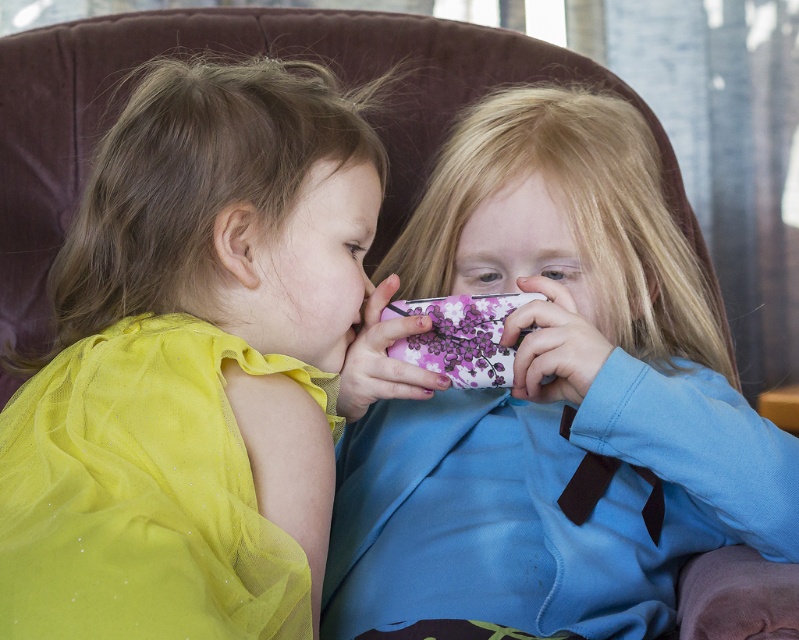
Between purple floral phone at center and matte yellow dress at left, which one has more height?

purple floral phone at center

Does point (654, 435) lie behind point (187, 243)?

No, it is in front of (187, 243).

Locate an element on the screen. This screenshot has width=799, height=640. purple floral phone at center is located at coordinates (549, 397).

Is point (330, 164) farther from camera compared to point (171, 541)?

Yes, it is.

The image size is (799, 640). What are the coordinates of `matte yellow dress at left` in the screenshot? It's located at (213, 321).

Where is `matte yellow dress at left`? This screenshot has width=799, height=640. matte yellow dress at left is located at coordinates [213, 321].

Who is positioned more to the left, purple floral phone at center or shiny yellow tulle dress at left?

A: From the viewer's perspective, shiny yellow tulle dress at left appears more on the left side.

Can you confirm if purple floral phone at center is shorter than shiny yellow tulle dress at left?

No, purple floral phone at center is not shorter than shiny yellow tulle dress at left.

Is point (523, 128) closer to viewer compared to point (149, 442)?

No, (523, 128) is behind (149, 442).

I want to click on purple floral phone at center, so click(x=549, y=397).